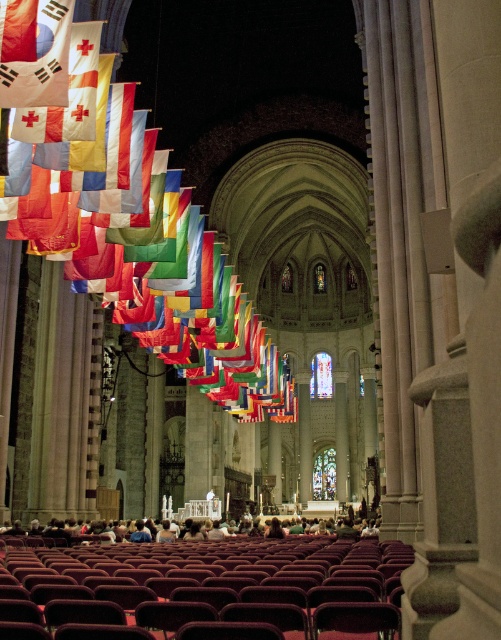
You are a visitor standing at the entrance of the cathedral and want to reach the matte red flag at upper left. Given that the velvet maroon chairs at lower center are directly in your path, can you walk around them to reach the flag? Please explain your reasoning.

The velvet maroon chairs at lower center are 132.15 feet away from the matte red flag at upper left. Since the chairs are directly in your path, you would need to navigate around them. However, the distance provided does not indicate the physical space available to maneuver around the chairs. Without knowing the size of the chairs or the width of the path, it is impossible to determine if you can walk around them to reach the flag.

You are a visitor standing in the cathedral and want to take a photo of the matte red flag at upper left without the velvet maroon chairs at lower center blocking the view. Where should you move to achieve this?

Move behind the velvet maroon chairs at lower center so that the matte red flag at upper left is visible without obstruction.

You are standing in the cathedral and see two points marked on the floor. The first point is at coordinate point (321, 538) and the second is at point (50, 145). Which point is closer to you?

Point (321, 538) is further to the viewer than point (50, 145), so the point closer to you is point (50, 145).